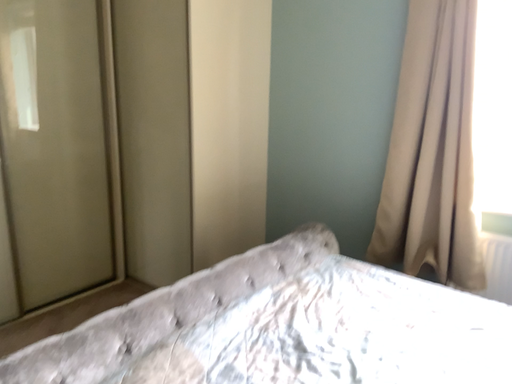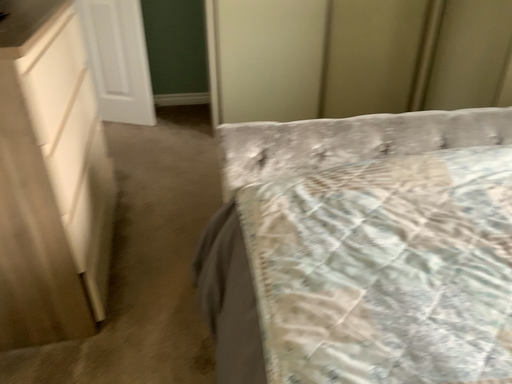
Question: How did the camera likely rotate when shooting the video?

Choices:
 (A) rotated right
 (B) rotated left

Answer: (B)